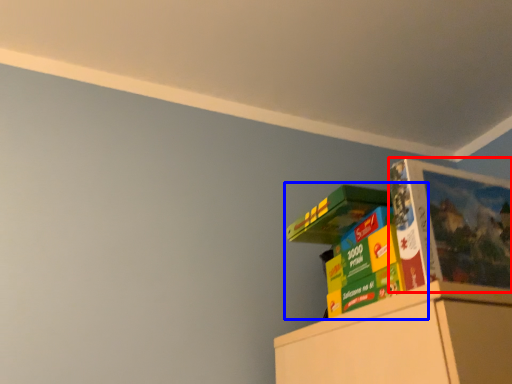
Question: Which object appears closest to the camera in this image, paperback book (highlighted by a red box) or book (highlighted by a blue box)?

Choices:
 (A) paperback book
 (B) book

Answer: (A)